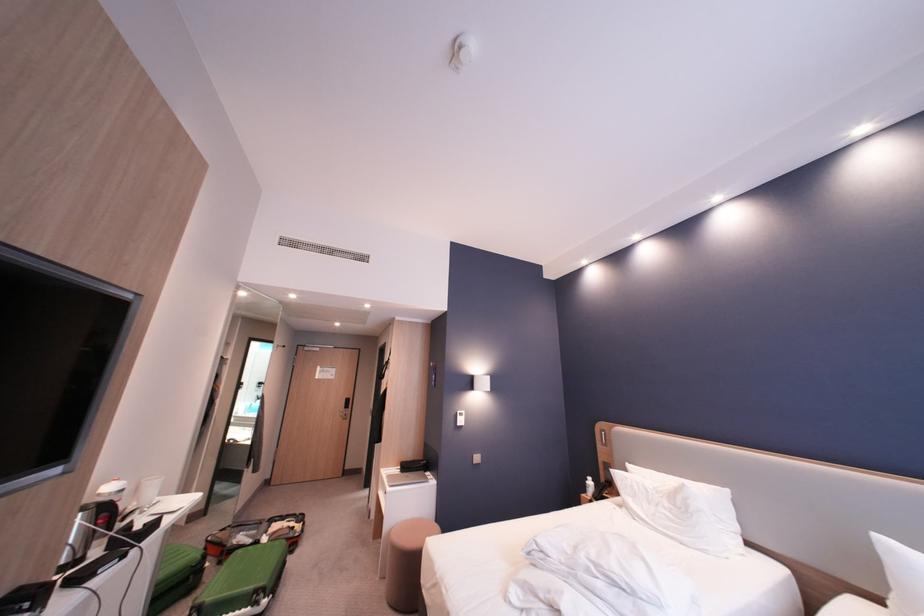
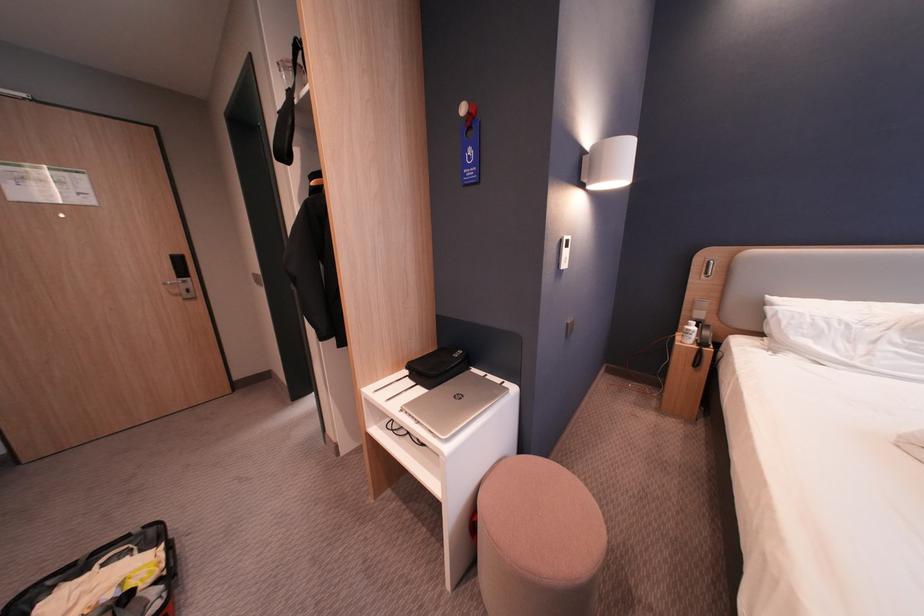
Find the pixel in the second image that matches (x=419, y=477) in the first image.

(475, 397)